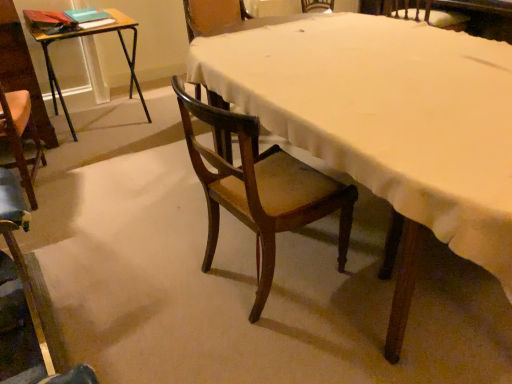
What do you see at coordinates (27, 270) in the screenshot? Image resolution: width=512 pixels, height=384 pixels. I see `wooden chair at lower left, the 1th chair viewed from the left` at bounding box center [27, 270].

This screenshot has height=384, width=512. Describe the element at coordinates (423, 14) in the screenshot. I see `wooden chair at upper right, marked as the first chair in a right-to-left arrangement` at that location.

At what (x,y) coordinates should I click in order to perform the action: click on wooden desk at left. Please return your answer as a coordinate pair (x, y). The width and height of the screenshot is (512, 384). Looking at the image, I should click on (84, 36).

Locate an element on the screen. wooden chair at lower left, which is the fourth chair in right-to-left order is located at coordinates (27, 270).

Measure the distance from wooden chair at center, which ranks as the third chair in right-to-left order, to wooden chair at center, arranged as the second chair when viewed from the right.

wooden chair at center, which ranks as the third chair in right-to-left order, and wooden chair at center, arranged as the second chair when viewed from the right, are 2.52 meters apart.

From the image's perspective, which is above, wooden chair at center, the 2th chair from the left, or wooden chair at center, arranged as the second chair when viewed from the right?

wooden chair at center, the 2th chair from the left.

Image resolution: width=512 pixels, height=384 pixels. Identify the location of the 1st chair counting from the right side of the wooden chair at center, which ranks as the third chair in right-to-left order. (261, 190).

Considering the relative positions of wooden chair at center, which ranks as the third chair in right-to-left order, and wooden chair at center, arranged as the second chair when viewed from the right, in the image provided, is wooden chair at center, which ranks as the third chair in right-to-left order, to the left or to the right of wooden chair at center, arranged as the second chair when viewed from the right,?

Clearly, wooden chair at center, which ranks as the third chair in right-to-left order, is on the left of wooden chair at center, arranged as the second chair when viewed from the right, in the image.

Does point (7, 206) come farther from viewer compared to point (471, 111)?

Yes.

Does wooden chair at lower left, the 1th chair viewed from the left, have a greater width compared to wooden chair at center?

No.

Find the location of a particular element. desk behind the wooden chair at lower left, which is the fourth chair in right-to-left order is located at coordinates (386, 125).

Does wooden chair at lower left, the 1th chair viewed from the left, have a greater height compared to wooden chair at center, which ranks as the third chair in right-to-left order?

No.

Considering the positions of objects wooden chair at lower left, the 1th chair viewed from the left, and wooden chair at center, which ranks as the third chair in right-to-left order, in the image provided, who is in front, wooden chair at lower left, the 1th chair viewed from the left, or wooden chair at center, which ranks as the third chair in right-to-left order,?

wooden chair at lower left, the 1th chair viewed from the left, is closer to the camera.

Does wooden chair at lower left, which is the fourth chair in right-to-left order, have a smaller size compared to wooden chair at center, which ranks as the third chair in right-to-left order?

Yes.

Which object is thinner, wooden chair at center, the 2th chair from the left, or wooden chair at center?

wooden chair at center, the 2th chair from the left, is thinner.

Considering the relative sizes of wooden chair at center, which ranks as the third chair in right-to-left order, and wooden chair at center in the image provided, is wooden chair at center, which ranks as the third chair in right-to-left order, bigger than wooden chair at center?

No, wooden chair at center, which ranks as the third chair in right-to-left order, is not bigger than wooden chair at center.

Is wooden chair at center, the 2th chair from the left, turned away from wooden chair at center?

No.

This screenshot has width=512, height=384. I want to click on desk located below the wooden chair at center, the 2th chair from the left (from the image's perspective), so click(x=386, y=125).

From a real-world perspective, is wooden chair at center, which ranks as the third chair in right-to-left order, under wooden desk at left?

Incorrect, from a real-world perspective, wooden chair at center, which ranks as the third chair in right-to-left order, is higher than wooden desk at left.

Between wooden chair at center, the 2th chair from the left, and wooden desk at left, which one is positioned in front?

wooden chair at center, the 2th chair from the left, is more forward.

In the scene shown: Which point is more forward, (x=204, y=8) or (x=126, y=16)?

The point (x=126, y=16) is closer.

From the image's perspective, is wooden chair at center, positioned as the third chair in left-to-right order, located above wooden chair at center, the 2th chair from the left?

No.

Which point is more forward, (x=241, y=205) or (x=208, y=21)?

The point (x=241, y=205) is in front.

Is wooden chair at center, positioned as the third chair in left-to-right order, further to camera compared to wooden chair at center, which ranks as the third chair in right-to-left order?

No, wooden chair at center, positioned as the third chair in left-to-right order, is closer to the viewer.

Is wooden chair at center, positioned as the third chair in left-to-right order, not inside wooden chair at center, the 2th chair from the left?

Yes, wooden chair at center, positioned as the third chair in left-to-right order, is located beyond the bounds of wooden chair at center, the 2th chair from the left.

From a real-world perspective, which is physically above, wooden chair at center, which ranks as the third chair in right-to-left order, or wooden chair at lower left, the 1th chair viewed from the left?

wooden chair at center, which ranks as the third chair in right-to-left order.

Is wooden chair at center, the 2th chair from the left, facing away from wooden chair at lower left, the 1th chair viewed from the left?

wooden chair at center, the 2th chair from the left, does not have its back to wooden chair at lower left, the 1th chair viewed from the left.

The image size is (512, 384). I want to click on chair that is the 2nd object above the wooden chair at lower left, the 1th chair viewed from the left (from a real-world perspective), so (x=212, y=16).

From a real-world perspective, count 1st chairs downward from the wooden chair at center, the 2th chair from the left, and point to it. Please provide its 2D coordinates.

[(261, 190)]

The image size is (512, 384). I want to click on desk above the wooden chair at lower left, the 1th chair viewed from the left (from the image's perspective), so click(386, 125).

Based on their spatial positions, is wooden chair at center, arranged as the second chair when viewed from the right, or wooden desk at left further from wooden chair at upper right, arranged as the fourth chair when viewed from the left?

wooden chair at center, arranged as the second chair when viewed from the right.

From the image, which object appears to be farther from wooden desk at left, wooden chair at center or wooden chair at center, which ranks as the third chair in right-to-left order?

wooden chair at center.

Based on their spatial positions, is wooden desk at left or wooden chair at upper right, arranged as the fourth chair when viewed from the left, closer to wooden chair at center?

Among the two, wooden desk at left is located nearer to wooden chair at center.

When comparing their distances from wooden desk at left, does wooden chair at lower left, which is the fourth chair in right-to-left order, or wooden chair at center, arranged as the second chair when viewed from the right, seem closer?

wooden chair at lower left, which is the fourth chair in right-to-left order, is positioned closer to the anchor wooden desk at left.

In the scene shown: Based on their spatial positions, is wooden chair at center, which ranks as the third chair in right-to-left order, or wooden desk at left closer to wooden chair at center?

wooden desk at left.

Estimate the real-world distances between objects in this image. Which object is further from wooden chair at upper right, marked as the first chair in a right-to-left arrangement, wooden chair at lower left, the 1th chair viewed from the left, or wooden chair at center?

Based on the image, wooden chair at lower left, the 1th chair viewed from the left, appears to be further to wooden chair at upper right, marked as the first chair in a right-to-left arrangement.

From the image, which object appears to be nearer to wooden chair at center, arranged as the second chair when viewed from the right, wooden chair at center, the 2th chair from the left, or wooden chair at center?

wooden chair at center.

Estimate the real-world distances between objects in this image. Which object is closer to wooden chair at center, wooden chair at center, positioned as the third chair in left-to-right order, or wooden desk at left?

wooden chair at center, positioned as the third chair in left-to-right order, lies closer to wooden chair at center than the other object.

Image resolution: width=512 pixels, height=384 pixels. What are the coordinates of `chair positioned between wooden chair at center, positioned as the third chair in left-to-right order, and wooden desk at left from near to far` in the screenshot? It's located at (212, 16).

Find the location of a particular element. The width and height of the screenshot is (512, 384). desk between wooden chair at lower left, which is the fourth chair in right-to-left order, and wooden desk at left in the front-back direction is located at coordinates (386, 125).

The width and height of the screenshot is (512, 384). What are the coordinates of `chair located between wooden chair at lower left, which is the fourth chair in right-to-left order, and wooden chair at center, the 2th chair from the left, in the depth direction` in the screenshot? It's located at pyautogui.click(x=261, y=190).

You are a GUI agent. You are given a task and a screenshot of the screen. Output one action in this format:
    pyautogui.click(x=<x>, y=<y>)
    Task: Click on the chair located between wooden chair at center, arranged as the second chair when viewed from the right, and wooden chair at upper right, marked as the first chair in a right-to-left arrangement, in the depth direction
    This screenshot has width=512, height=384.
    Given the screenshot: What is the action you would take?
    pyautogui.click(x=212, y=16)